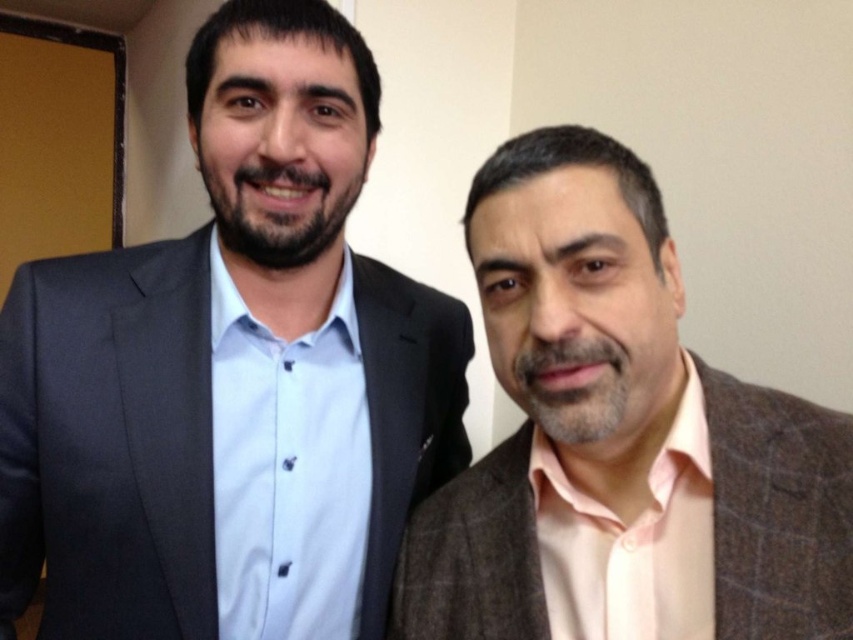
You are a photographer setting up for a group photo. You want to ensure that both the matte black suit at left and the brown textured suit at right are fully visible in the frame. Based on their positions, which suit is closer to the camera?

The matte black suit at left is closer to the camera since the brown textured suit at right is positioned behind it.

You are attending a professional event and need to identify the location of two attendees based on their attire. The matte black suit at left and the brown textured suit at right are in the same room. According to the scene, which one is positioned higher up?

The matte black suit at left is located above the brown textured suit at right, so it is positioned higher up in the scene.

You are organizing a photoshoot and need to ensure that the two suits in the image are displayed properly. Given that the matte black suit at left and the brown textured suit at right must be hung side by side in a closet with a total width of 1.2 meters, can you determine if both suits will fit without overlapping?

The matte black suit at left is wider than the brown textured suit at right. Since the total width of both suits combined would exceed 1.2 meters, they cannot be hung side by side without overlapping in the closet.